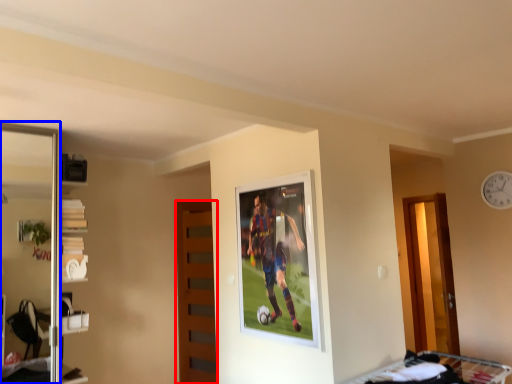
Question: Which point is further to the camera, door (highlighted by a red box) or screen door (highlighted by a blue box)?

Choices:
 (A) door
 (B) screen door

Answer: (A)